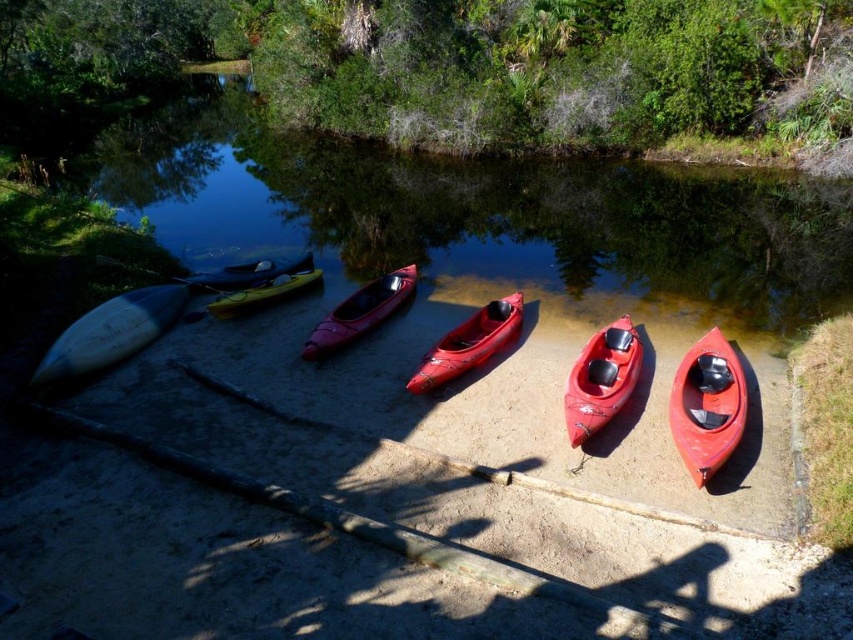
You are standing on the sandy riverbank and want to retrieve your kayak. You see the matte red kayak at lower right and the glossy plastic canoe at center. Which one is closer to you?

The matte red kayak at lower right is closer to you because it is positioned in front of the glossy plastic canoe at center.

You are planning to carry both the matte red kayak at lower right and the matte red kayak at center to a storage shed. Which kayak will require more space in the shed because of its size?

The matte red kayak at center requires more space because its width is greater than the matte red kayak at lower right.

You are standing on the sandy riverbank and want to reach the matte red kayak at center. There is a white matte canoe at left in your way. Which object should you move first to get to the kayak?

You should move the white matte canoe at left first because it is closer to you and blocking the path to the matte red kayak at center.